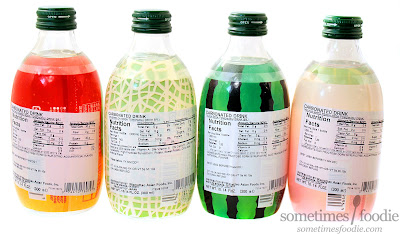
The height and width of the screenshot is (234, 400). I want to click on far right bottle, so click(368, 102).